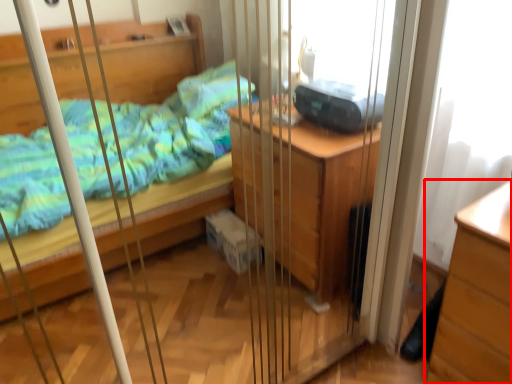
Question: From the image's perspective, where is chest of drawers (annotated by the red box) located in relation to equipment in the image?

Choices:
 (A) below
 (B) above

Answer: (A)